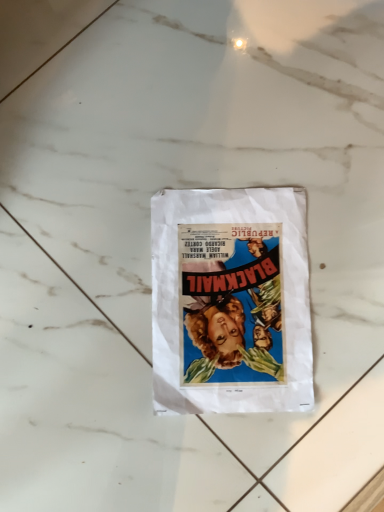
Locate an element on the screen. Image resolution: width=384 pixels, height=512 pixels. free space above vintage paper poster at center (from a real-world perspective) is located at coordinates (241, 304).